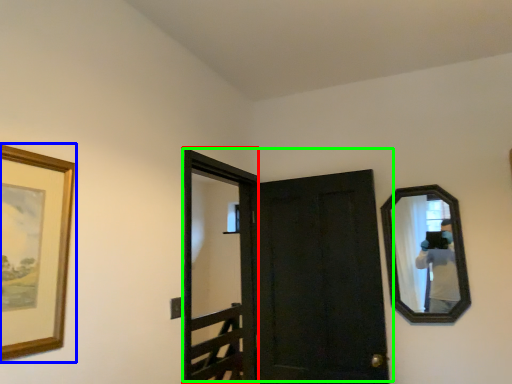
Question: Based on their relative distances, which object is farther from screen door (highlighted by a red box)? Choose from picture frame (highlighted by a blue box) and door (highlighted by a green box).

Choices:
 (A) picture frame
 (B) door

Answer: (A)